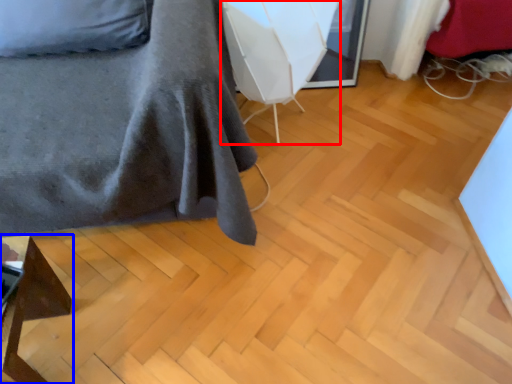
Question: Which of the following is the farthest to the observer, swivel chair (highlighted by a red box) or furniture (highlighted by a blue box)?

Choices:
 (A) swivel chair
 (B) furniture

Answer: (A)